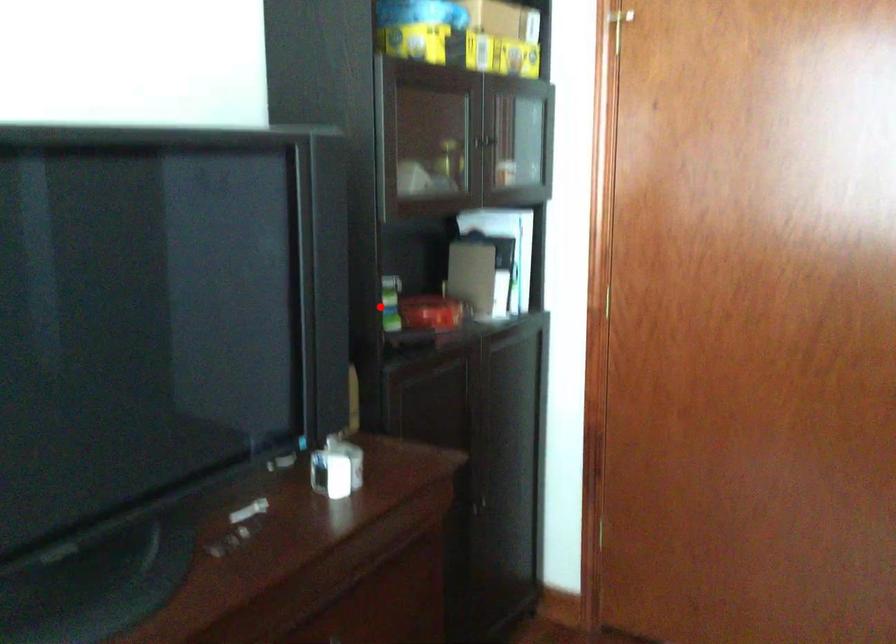
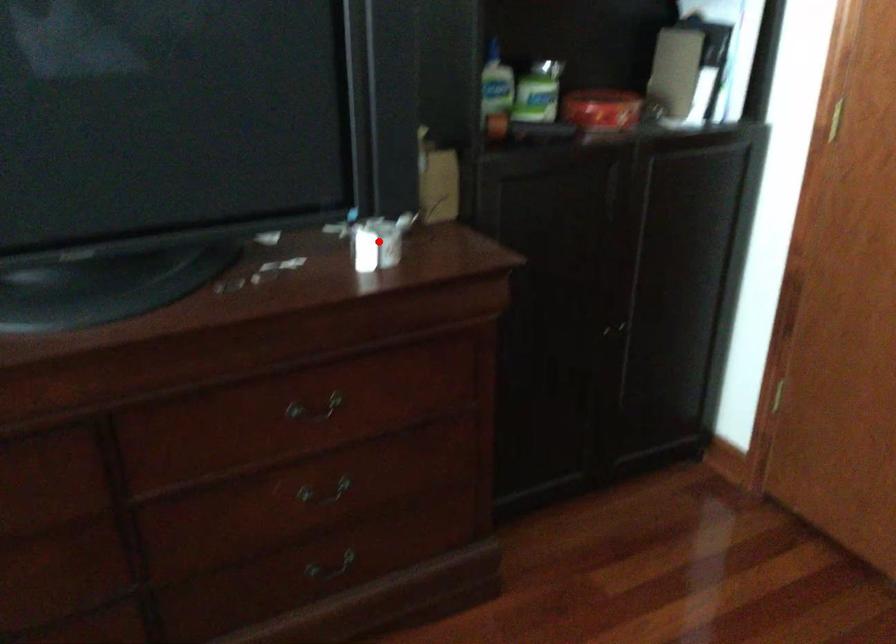
I am providing you with two images of the same scene from different viewpoints. A red point is marked on the first image and another point is marked on the second image. Are the points marked in image1 and image2 representing the same 3D position?

No